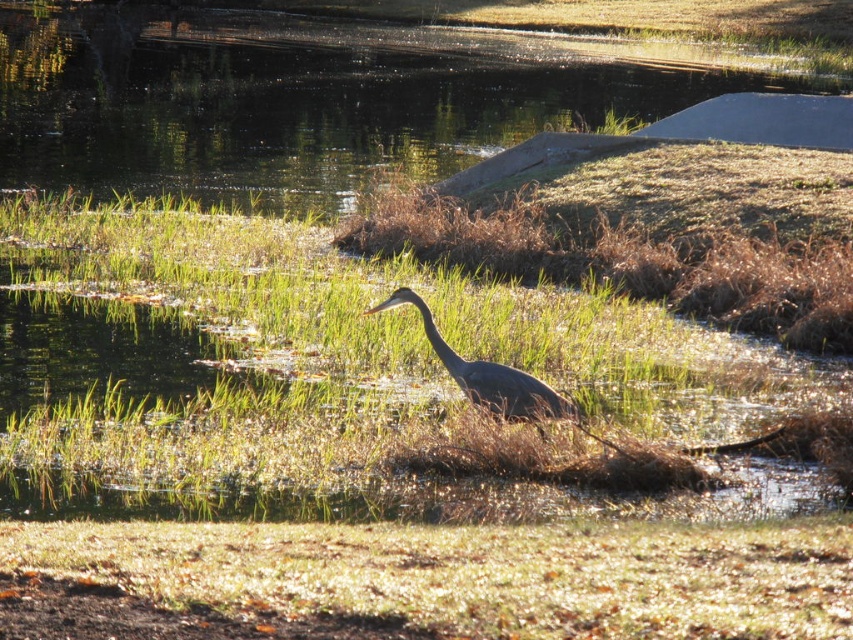
Is clear water at center positioned in front of gray matte heron at center?

That is False.

The image size is (853, 640). Identify the location of clear water at center. (308, 99).

What are the coordinates of `clear water at center` in the screenshot? It's located at (308, 99).

Locate an element on the screen. This screenshot has width=853, height=640. clear water at center is located at coordinates [x=308, y=99].

Does point (767, 417) lie in front of point (113, 99)?

Yes, it is.

Consider the image. Is green grass at center positioned behind clear water at center?

That is False.

Between point (419, 360) and point (229, 72), which one is positioned behind?

The point (229, 72) is more distant.

The image size is (853, 640). I want to click on green grass at center, so click(367, 385).

Does green grass at center have a lesser width compared to gray matte heron at center?

No.

You are a GUI agent. You are given a task and a screenshot of the screen. Output one action in this format:
    pyautogui.click(x=<x>, y=<y>)
    Task: Click on the green grass at center
    
    Given the screenshot: What is the action you would take?
    pyautogui.click(x=367, y=385)

Is point (215, 474) closer to camera compared to point (492, 376)?

Yes, point (215, 474) is closer to viewer.

The image size is (853, 640). Identify the location of green grass at center. (367, 385).